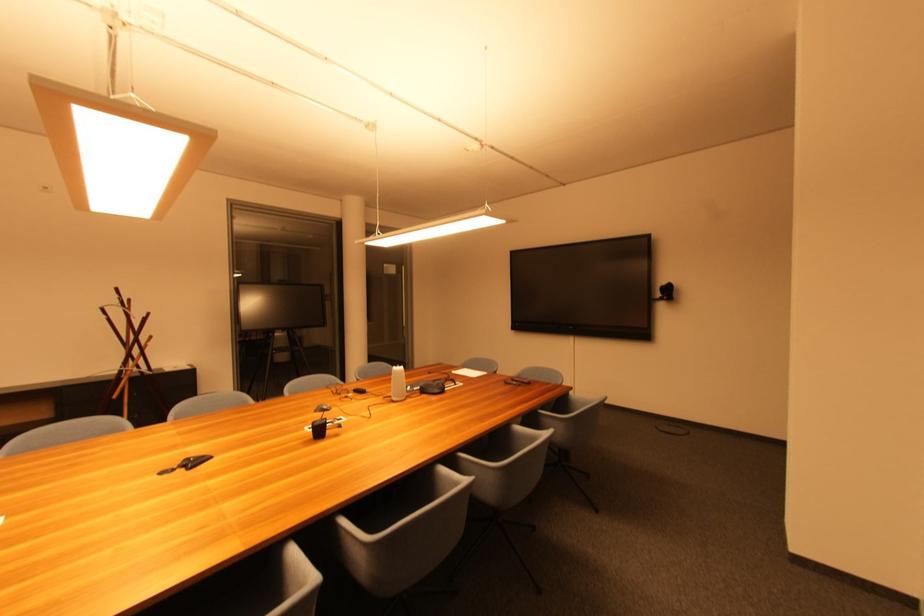
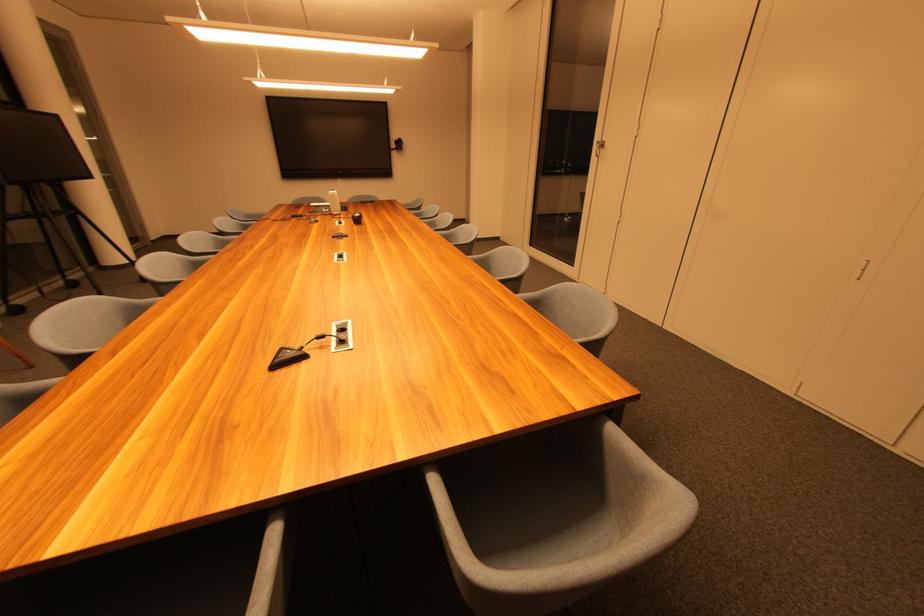
Where in the second image is the point corresponding to point 399,373 from the first image?

(337, 196)